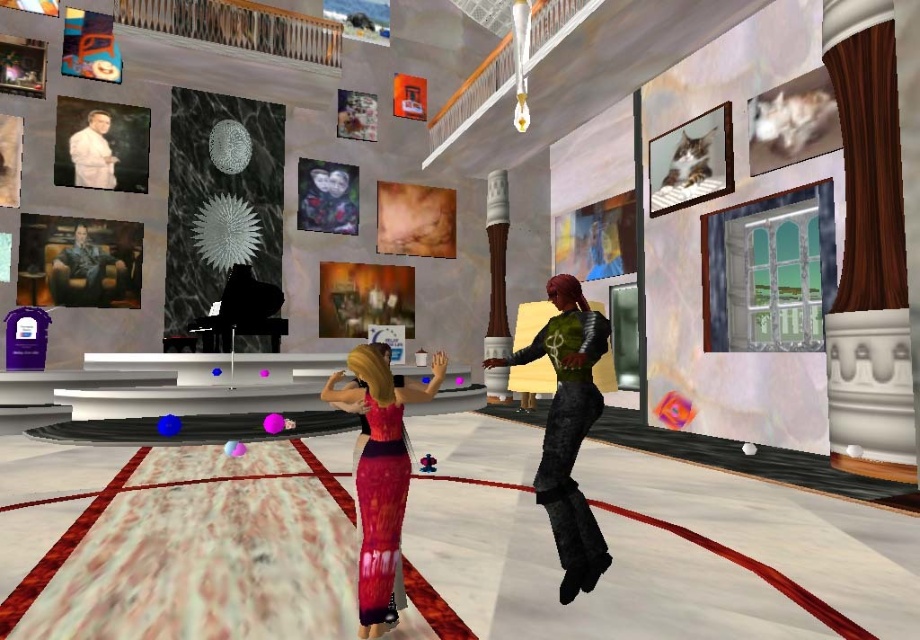
Is point (569, 320) farther from camera compared to point (105, 173)?

No, it is in front of (105, 173).

Does point (576, 381) come in front of point (96, 134)?

Yes, point (576, 381) is closer to viewer.

Image resolution: width=920 pixels, height=640 pixels. What are the coordinates of `green metallic armor at center` in the screenshot? It's located at (568, 429).

Can you confirm if knitted pink dress at center is taller than white matte suit at upper left?

In fact, knitted pink dress at center may be shorter than white matte suit at upper left.

The width and height of the screenshot is (920, 640). Find the location of `knitted pink dress at center`. knitted pink dress at center is located at coordinates (380, 476).

Find the location of a particular element. The image size is (920, 640). knitted pink dress at center is located at coordinates (380, 476).

Is green metallic armor at center thinner than knitted pink dress at center?

Incorrect, green metallic armor at center's width is not less than knitted pink dress at center's.

Can you confirm if green metallic armor at center is positioned below knitted pink dress at center?

No.

Which is in front, point (587, 513) or point (383, 401)?

Positioned in front is point (383, 401).

This screenshot has width=920, height=640. Find the location of `green metallic armor at center`. green metallic armor at center is located at coordinates (568, 429).